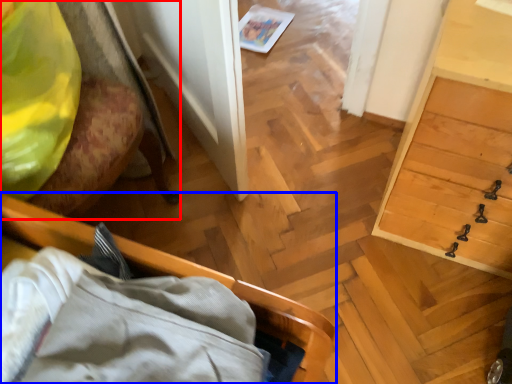
Question: Which object is further to the camera taking this photo, furniture (highlighted by a red box) or furniture (highlighted by a blue box)?

Choices:
 (A) furniture
 (B) furniture

Answer: (A)